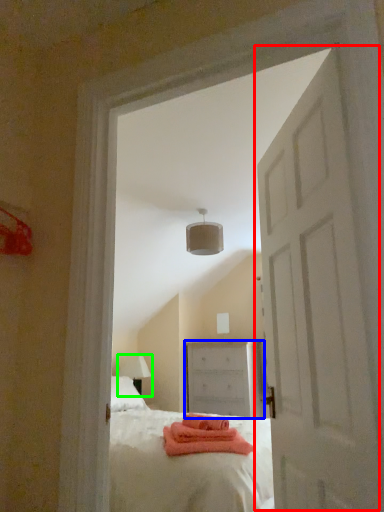
Question: Which object is positioned closest to door (highlighted by a red box)? Select from chest of drawers (highlighted by a blue box) and table lamp (highlighted by a green box).

Choices:
 (A) chest of drawers
 (B) table lamp

Answer: (A)